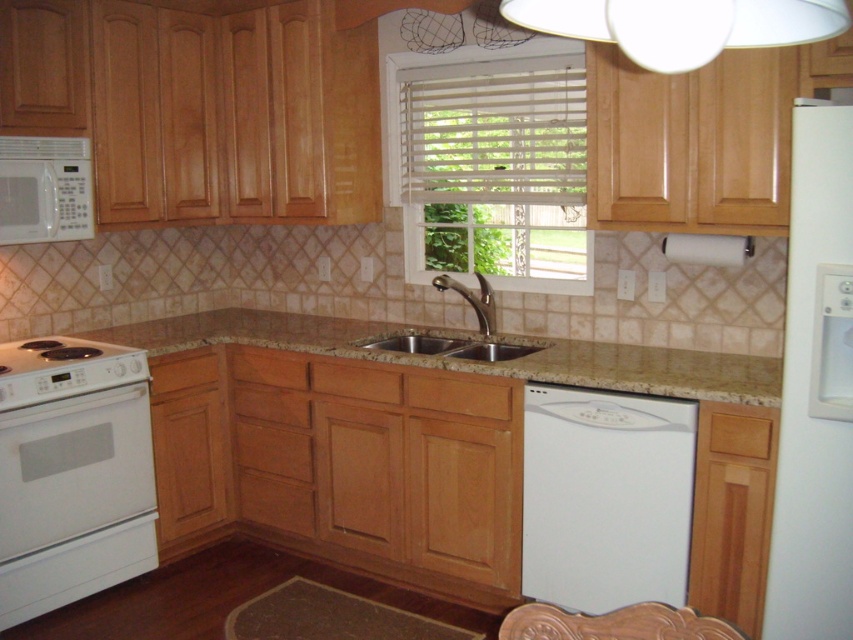
Between point (787, 472) and point (543, 522), which one is positioned in front?

Point (787, 472) is more forward.

Can you confirm if white plastic refrigerator at right is shorter than white matte dishwasher at lower center?

Incorrect, white plastic refrigerator at right's height does not fall short of white matte dishwasher at lower center's.

Is point (824, 579) positioned behind point (529, 554)?

That is False.

Locate an element on the screen. Image resolution: width=853 pixels, height=640 pixels. white plastic refrigerator at right is located at coordinates (815, 392).

Is the position of white matte lampshade at upper center less distant than that of white matte microwave at upper left?

Yes, it is in front of white matte microwave at upper left.

How far apart are white matte lampshade at upper center and white matte microwave at upper left?

The distance of white matte lampshade at upper center from white matte microwave at upper left is 8.54 feet.

Which is in front, point (572, 33) or point (53, 227)?

Point (572, 33)

Where is `white matte lampshade at upper center`? This screenshot has height=640, width=853. white matte lampshade at upper center is located at coordinates (682, 24).

Which is below, white glossy electric stove at lower left or stainless steel sink at center?

Positioned lower is white glossy electric stove at lower left.

This screenshot has width=853, height=640. Find the location of `white glossy electric stove at lower left`. white glossy electric stove at lower left is located at coordinates (62, 369).